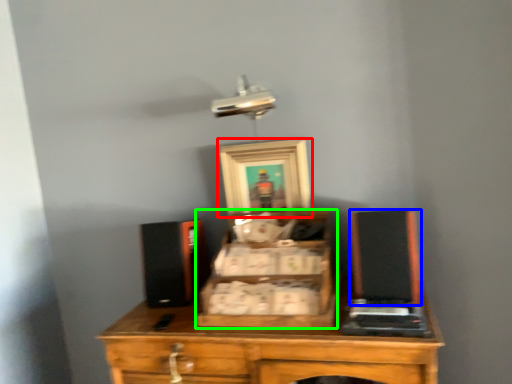
Question: Estimate the real-world distances between objects in this image. Which object is farther from picture frame (highlighted by a red box), wide (highlighted by a blue box) or drawer (highlighted by a green box)?

Choices:
 (A) wide
 (B) drawer

Answer: (A)